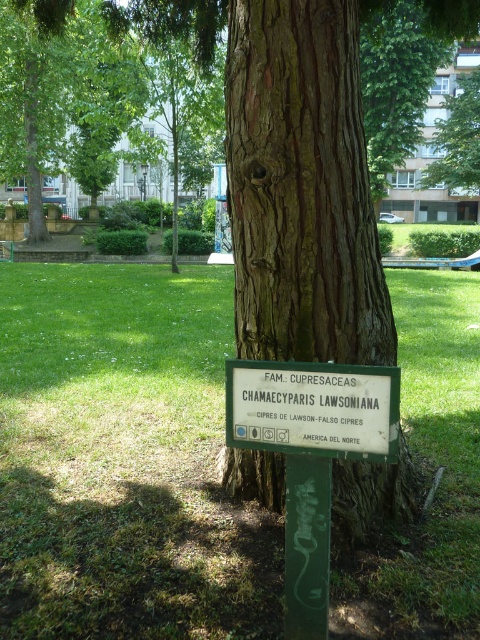
Question: Can you confirm if green grass at center is positioned above green plastic sign at center?

Choices:
 (A) no
 (B) yes

Answer: (B)

Question: Can you confirm if brown rough bark at center is positioned above green plastic sign at center?

Choices:
 (A) no
 (B) yes

Answer: (B)

Question: Which object appears farthest from the camera in this image?

Choices:
 (A) green grass at center
 (B) green plastic sign at center
 (C) brown rough bark at center

Answer: (C)

Question: Which of these objects is positioned closest to the green plastic sign at center?

Choices:
 (A) brown rough bark at center
 (B) green grass at center

Answer: (A)

Question: Which object is the closest to the green grass at center?

Choices:
 (A) brown rough bark at center
 (B) green plastic sign at center

Answer: (B)

Question: Is green grass at center positioned before green plastic sign at center?

Choices:
 (A) no
 (B) yes

Answer: (A)